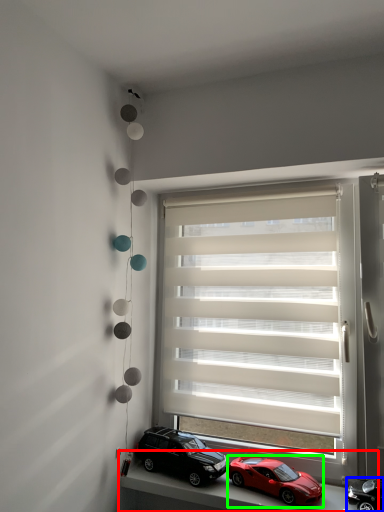
Question: Considering the real-world distances, which object is farthest from window sill (highlighted by a red box)? car (highlighted by a blue box) or car (highlighted by a green box)?

Choices:
 (A) car
 (B) car

Answer: (A)